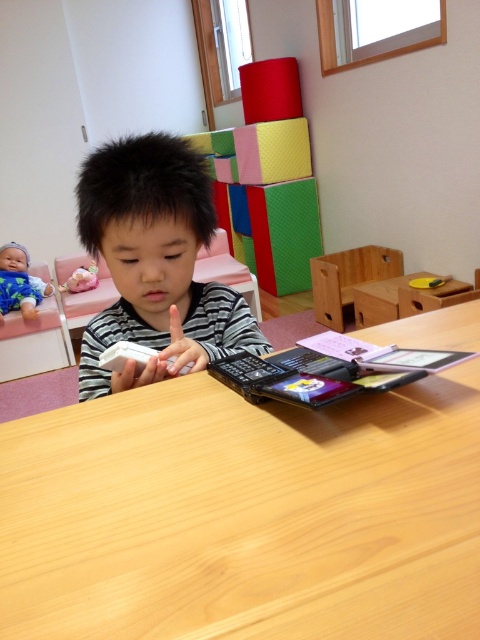
Question: Which object appears farthest from the camera in this image?

Choices:
 (A) matte pink plush at left
 (B) black striped shirt at center

Answer: (A)

Question: Among these objects, which one is farthest from the camera?

Choices:
 (A) blue fabric baby doll at upper left
 (B) black striped shirt at center
 (C) matte pink plush at left

Answer: (C)

Question: Which is nearer to the matte pink plush at left?

Choices:
 (A) wooden table at center
 (B) blue fabric baby doll at upper left

Answer: (B)

Question: Does black striped shirt at center appear over blue fabric baby doll at upper left?

Choices:
 (A) yes
 (B) no

Answer: (B)

Question: Does wooden table at center appear under blue fabric baby doll at upper left?

Choices:
 (A) yes
 (B) no

Answer: (A)

Question: Does wooden table at center appear over black striped shirt at center?

Choices:
 (A) no
 (B) yes

Answer: (A)